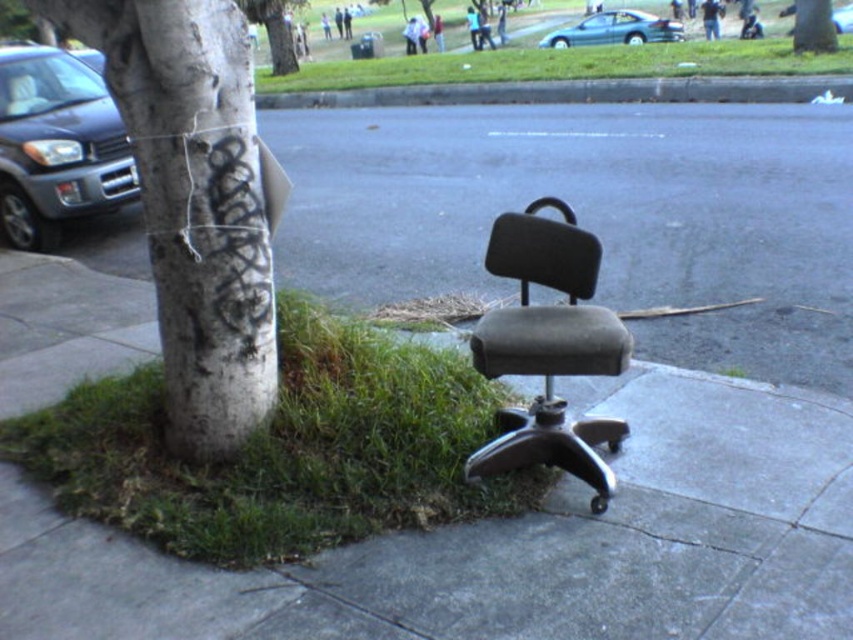
Question: Which of the following is the farthest from the observer?

Choices:
 (A) teal glossy sedan at upper center
 (B) white textured tree trunk at upper center
 (C) green grass at lower left

Answer: (A)

Question: Is green grass at lower left further to the viewer compared to white textured tree trunk at center-left?

Choices:
 (A) no
 (B) yes

Answer: (B)

Question: Can you confirm if white textured tree trunk at center-left is positioned above gray asphalt curb at center?

Choices:
 (A) yes
 (B) no

Answer: (B)

Question: Does gray rubber chair at center appear under green grass at lower left?

Choices:
 (A) yes
 (B) no

Answer: (A)

Question: Among these points, which one is farthest from the camera?

Choices:
 (A) (283, 70)
 (B) (54, 177)
 (C) (490, 339)
 (D) (305, 346)

Answer: (A)

Question: Which point is closer to the camera?

Choices:
 (A) (222, 324)
 (B) (607, 19)

Answer: (A)